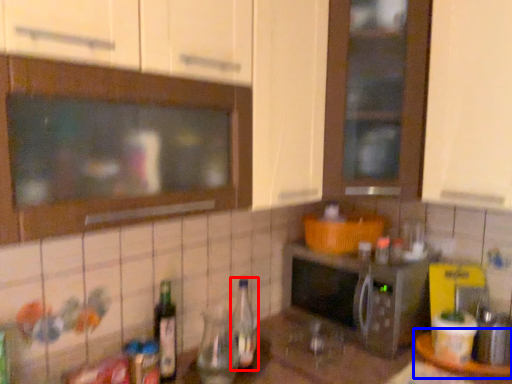
Question: Among these objects, which one is farthest to the camera, bottle (highlighted by a red box) or table (highlighted by a blue box)?

Choices:
 (A) bottle
 (B) table

Answer: (B)